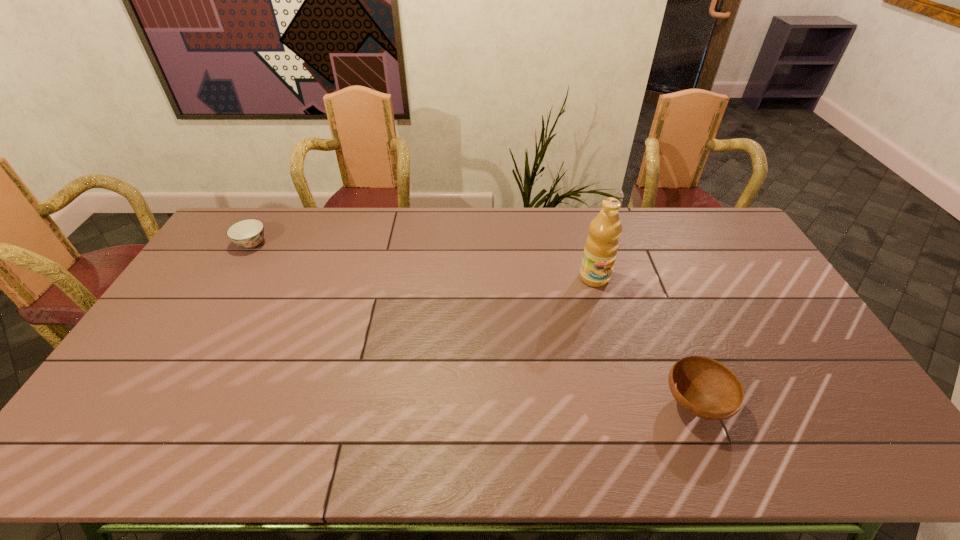
Where is `object positioned at the near edge`? The image size is (960, 540). object positioned at the near edge is located at coordinates (704, 387).

Identify the location of object that is at the left edge. (248, 233).

This screenshot has height=540, width=960. I want to click on object at the far left corner, so click(x=248, y=233).

In the image, there is a desktop. Identify the location of blank space at the far edge. (457, 237).

At what (x,y) coordinates should I click in order to perform the action: click on blank space at the near edge of the desktop. Please return your answer as a coordinate pair (x, y). This screenshot has width=960, height=540. Looking at the image, I should click on (409, 449).

In the image, there is a desktop. Where is `free space at the right edge`? The image size is (960, 540). free space at the right edge is located at coordinates (790, 395).

Where is `vacant area at the near left corner of the desktop`? The height and width of the screenshot is (540, 960). vacant area at the near left corner of the desktop is located at coordinates (132, 435).

At what (x,y) coordinates should I click in order to perform the action: click on vacant point located between the nearest object and the soup bowl. Please return your answer as a coordinate pair (x, y). The height and width of the screenshot is (540, 960). Looking at the image, I should click on (473, 324).

Find the location of `vacant space that's between the leftmost object and the nearest object`. vacant space that's between the leftmost object and the nearest object is located at coordinates (473, 324).

The height and width of the screenshot is (540, 960). I want to click on vacant point located between the farthest object and the olive oil, so click(x=423, y=261).